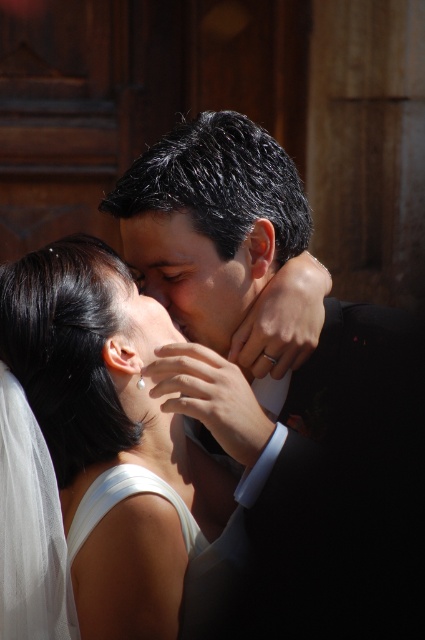
Who is more distant from viewer, (53, 316) or (150, 248)?

Point (150, 248)

Is point (130, 588) positioned in front of point (214, 268)?

Yes.

Is point (135, 636) less distant than point (234, 312)?

Yes, it is in front of point (234, 312).

The height and width of the screenshot is (640, 425). Find the location of `white satin dress at center`. white satin dress at center is located at coordinates (110, 435).

Which is above, black satin suit at center or smooth skin face at center?

smooth skin face at center

Does point (207, 116) come closer to viewer compared to point (178, 253)?

No, it is behind (178, 253).

Locate an element on the screen. black satin suit at center is located at coordinates (285, 400).

Describe the element at coordinates (285, 400) in the screenshot. I see `black satin suit at center` at that location.

Does black satin suit at center have a greater height compared to white satin dress at center?

No.

Is point (178, 376) in front of point (51, 426)?

That is True.

At what (x,y) coordinates should I click in order to perform the action: click on black satin suit at center. Please return your answer as a coordinate pair (x, y). This screenshot has width=425, height=640. Looking at the image, I should click on (285, 400).